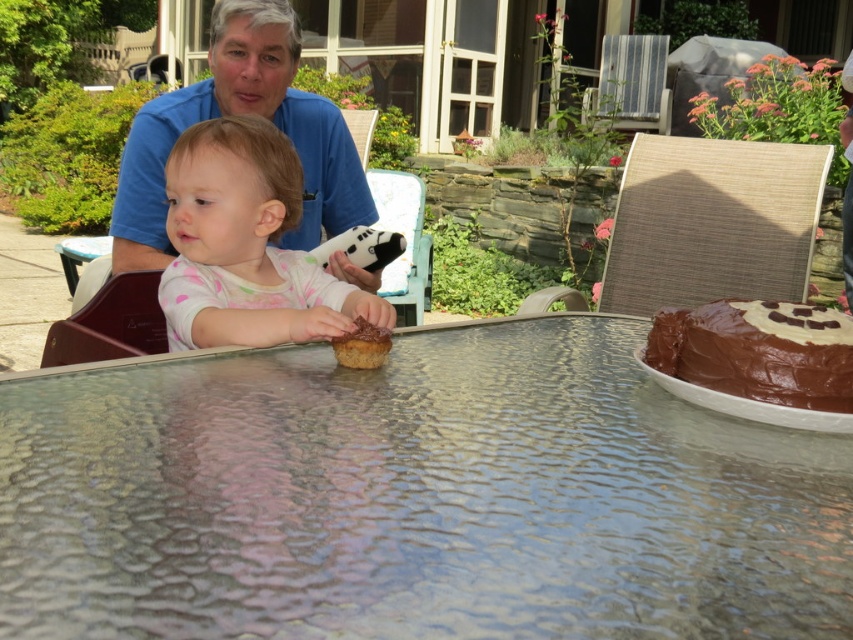
Question: Does matte blue shirt at upper left have a greater width compared to chocolate matte cake at right?

Choices:
 (A) no
 (B) yes

Answer: (B)

Question: Can you confirm if white dotted fabric at center is wider than matte blue shirt at upper left?

Choices:
 (A) yes
 (B) no

Answer: (B)

Question: Is transparent textured glass at center bigger than chocolate cake at center?

Choices:
 (A) no
 (B) yes

Answer: (B)

Question: Which object appears closest to the camera in this image?

Choices:
 (A) chocolate cake at center
 (B) matte blue shirt at upper left
 (C) transparent textured glass at center

Answer: (C)

Question: Which point is farther to the camera?

Choices:
 (A) (223, 108)
 (B) (788, 381)
 (C) (102, 428)
 (D) (202, 262)

Answer: (A)

Question: Which of the following is the closest to the observer?

Choices:
 (A) (259, 317)
 (B) (546, 595)
 (C) (236, 65)

Answer: (B)